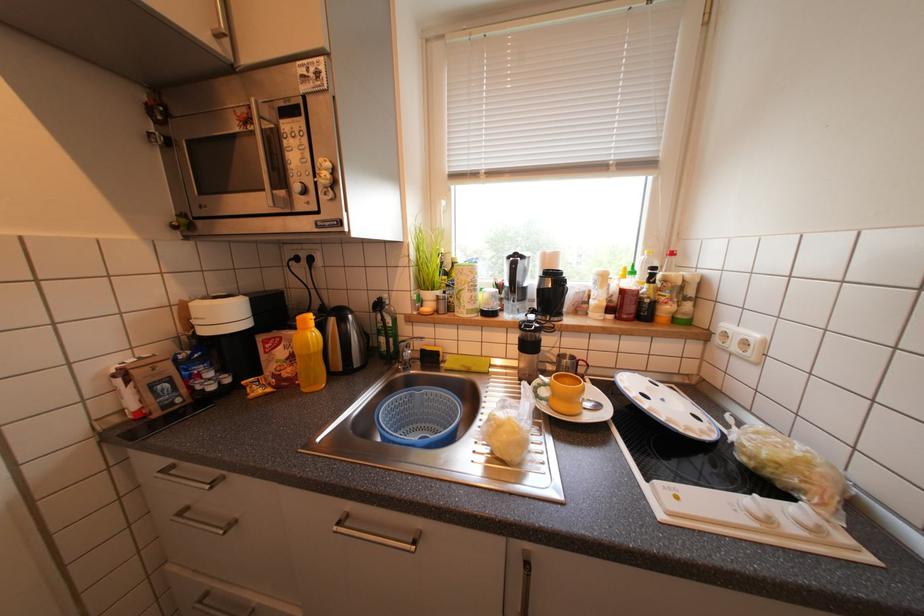
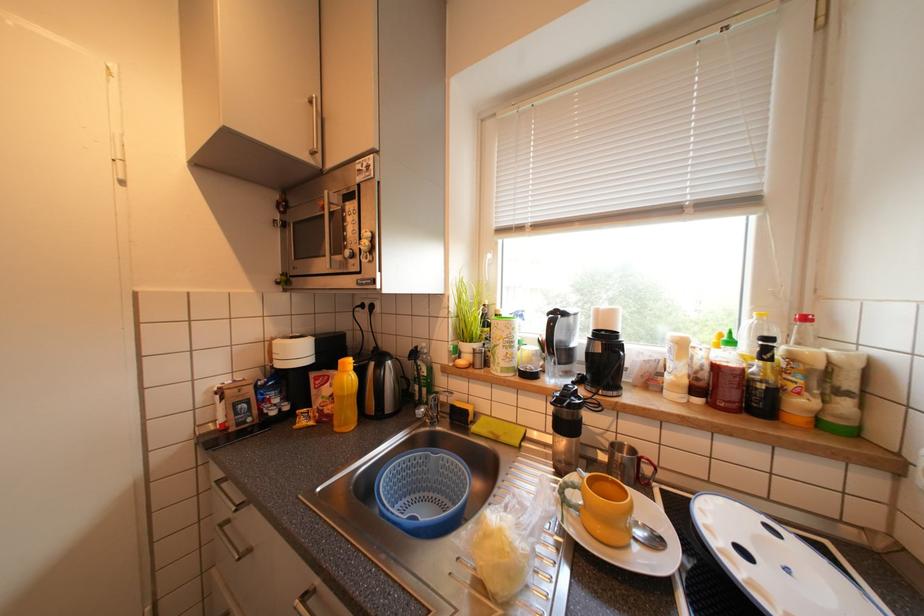
Question: How did the camera likely rotate?

Choices:
 (A) Left
 (B) Right
 (C) Up
 (D) Down

Answer: (A)